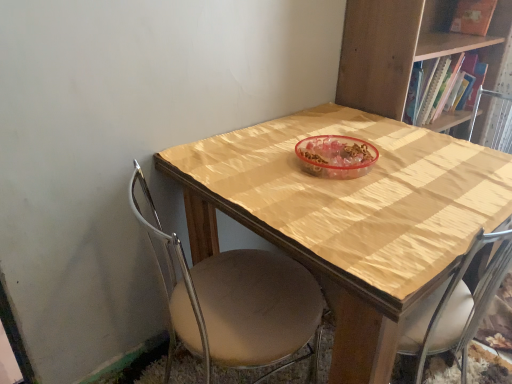
Question: Is beige fabric chair at center positioned with its back to wooden table at center?

Choices:
 (A) no
 (B) yes

Answer: (B)

Question: Considering the relative positions of beige fabric chair at center and wooden table at center in the image provided, is beige fabric chair at center to the right of wooden table at center from the viewer's perspective?

Choices:
 (A) no
 (B) yes

Answer: (A)

Question: From the image's perspective, is beige fabric chair at center above wooden table at center?

Choices:
 (A) yes
 (B) no

Answer: (B)

Question: Would you say beige fabric chair at center is outside wooden table at center?

Choices:
 (A) yes
 (B) no

Answer: (B)

Question: Does beige fabric chair at center have a greater height compared to wooden table at center?

Choices:
 (A) no
 (B) yes

Answer: (B)

Question: Considering the positions of matte orange book at upper right and beige fabric chair at center in the image, is matte orange book at upper right wider or thinner than beige fabric chair at center?

Choices:
 (A) wide
 (B) thin

Answer: (B)

Question: From a real-world perspective, relative to beige fabric chair at center, is matte orange book at upper right vertically above or below?

Choices:
 (A) above
 (B) below

Answer: (A)

Question: Considering the relative positions of matte orange book at upper right and beige fabric chair at center in the image provided, is matte orange book at upper right to the left or to the right of beige fabric chair at center?

Choices:
 (A) left
 (B) right

Answer: (B)

Question: In terms of size, does matte orange book at upper right appear bigger or smaller than beige fabric chair at center?

Choices:
 (A) small
 (B) big

Answer: (A)

Question: Looking at their shapes, would you say wooden bookcase at upper right is wider or thinner than beige fabric chair at center?

Choices:
 (A) wide
 (B) thin

Answer: (B)

Question: From a real-world perspective, is wooden bookcase at upper right physically located above or below beige fabric chair at center?

Choices:
 (A) below
 (B) above

Answer: (B)

Question: In the image, is wooden bookcase at upper right positioned in front of or behind beige fabric chair at center?

Choices:
 (A) behind
 (B) front

Answer: (A)

Question: Visually, is wooden bookcase at upper right positioned to the left or to the right of beige fabric chair at center?

Choices:
 (A) left
 (B) right

Answer: (B)

Question: Is beige fabric chair at center wider or thinner than matte orange book at upper right?

Choices:
 (A) thin
 (B) wide

Answer: (B)

Question: From the image's perspective, is beige fabric chair at center above or below matte orange book at upper right?

Choices:
 (A) below
 (B) above

Answer: (A)